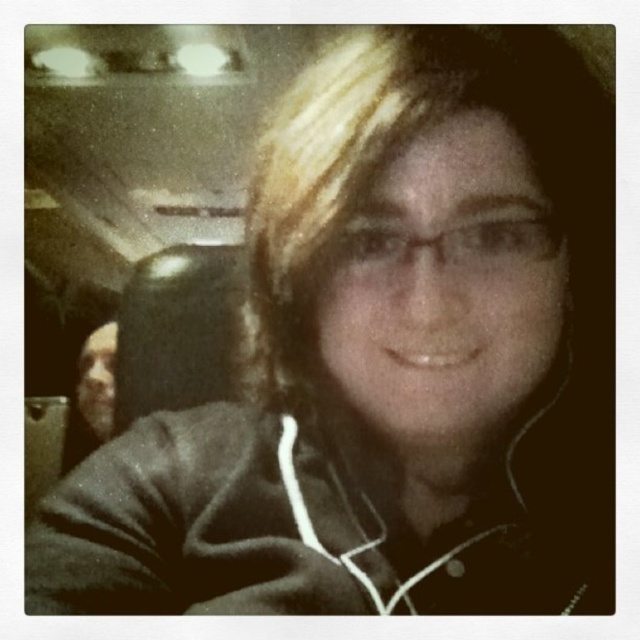
Looking at the selfie, which object is smaller between the blondehair at center and the smooth skin face at left?

The blondehair at center is smaller than the smooth skin face at left.

In the scene shown: In the image, there is a point labeled as blondehair at center located at coordinates point (392, 154). If you were to draw a vertical line through this point, would it pass through the subject of the selfie?

The point (392, 154) indicates blondehair at center. Since the point is labeled as being at the center, a vertical line drawn through this point would indeed pass through the subject of the selfie as the center point typically aligns with the subject in such compositions.

You are a photographer adjusting your camera settings. You notice two subjects in the frame, the blondehair at center and the smooth skin face at left. Which subject is farther away from the camera?

Answer: The blondehair at center is 6.62 feet away from the smooth skin face at left, so the blondehair at center is farther away from the camera than the smooth skin face at left.